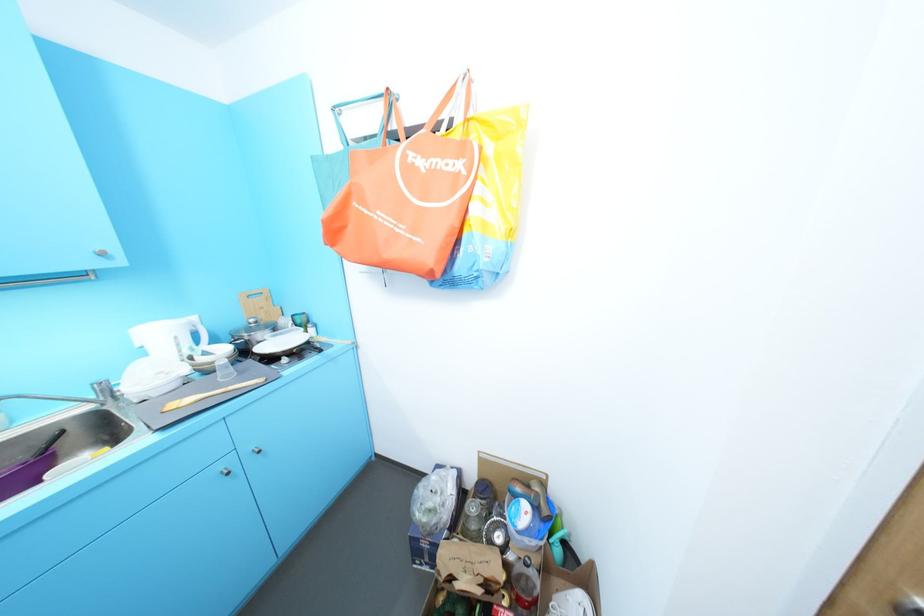
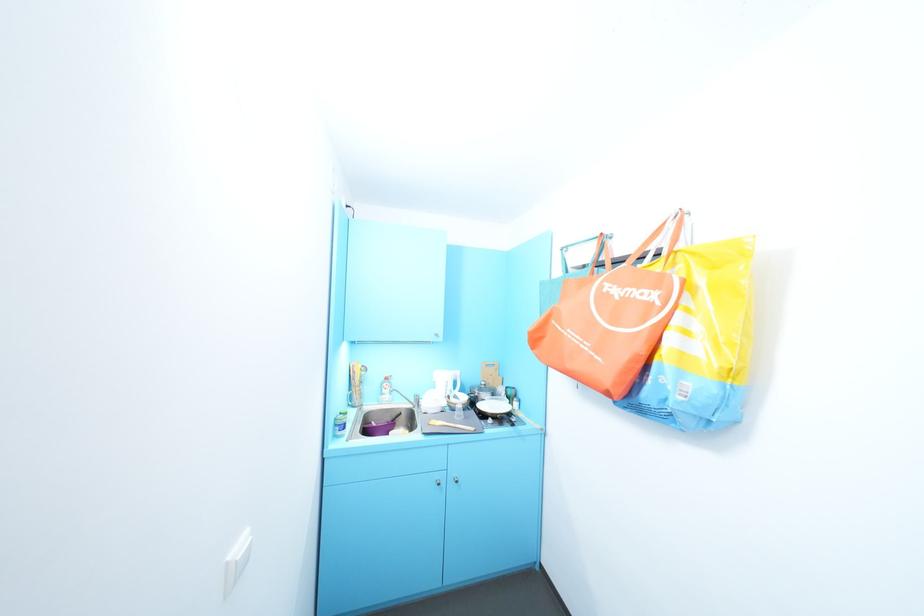
Where in the second image is the point corresponding to (396,100) from the first image?

(610, 241)